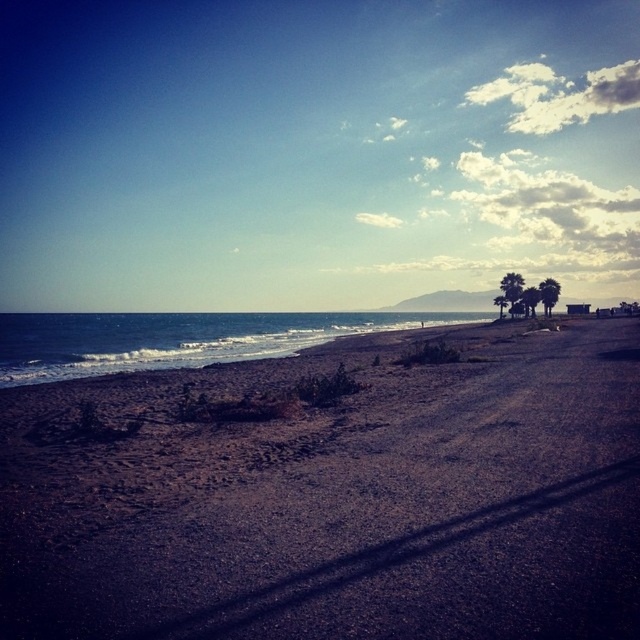
Does dark brown gravel at lower left come in front of blue water at lower left?

Yes, it is.

Between point (284, 566) and point (60, 362), which one is positioned in front?

Point (284, 566) is more forward.

You are a GUI agent. You are given a task and a screenshot of the screen. Output one action in this format:
    pyautogui.click(x=<x>, y=<y>)
    Task: Click on the dark brown gravel at lower left
    The width and height of the screenshot is (640, 640).
    Given the screenshot: What is the action you would take?
    pyautogui.click(x=333, y=496)